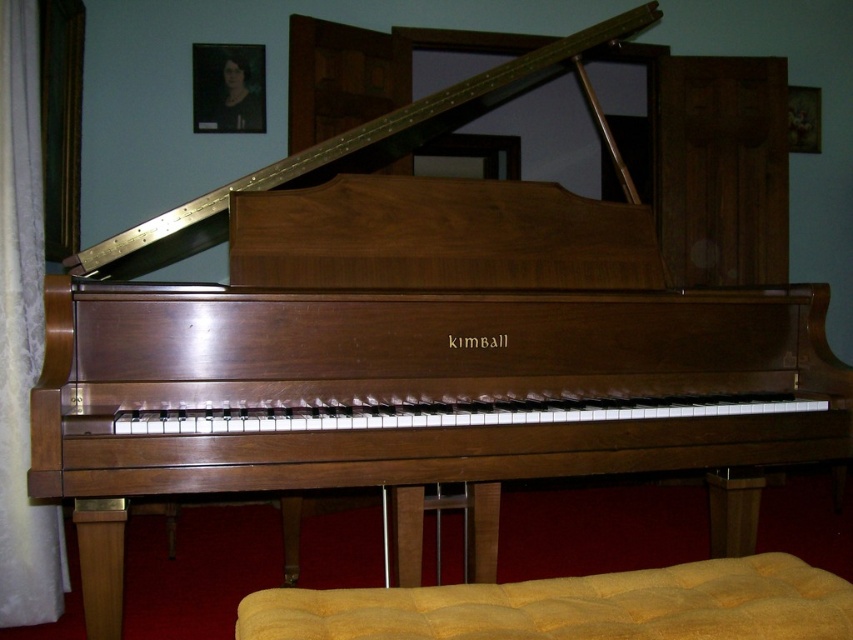
Question: Observing the image, what is the correct spatial positioning of yellow fabric footrest at lower center in reference to velvet curtain at left?

Choices:
 (A) below
 (B) above

Answer: (A)

Question: Which point is closer to the camera?

Choices:
 (A) (434, 624)
 (B) (21, 392)

Answer: (A)

Question: Does yellow fabric footrest at lower center appear under velvet curtain at left?

Choices:
 (A) no
 (B) yes

Answer: (B)

Question: Where is yellow fabric footrest at lower center located in relation to velvet curtain at left in the image?

Choices:
 (A) right
 (B) left

Answer: (A)

Question: Among these points, which one is nearest to the camera?

Choices:
 (A) (3, 108)
 (B) (648, 628)

Answer: (B)

Question: Among these objects, which one is nearest to the camera?

Choices:
 (A) yellow fabric footrest at lower center
 (B) velvet curtain at left

Answer: (A)